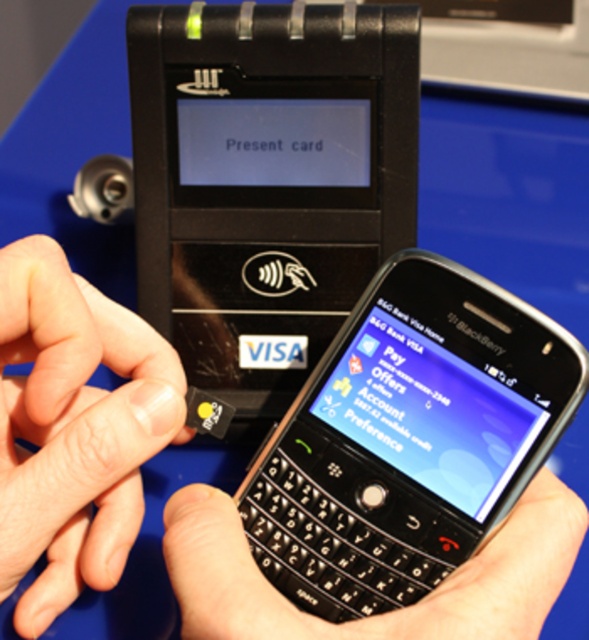
From the picture: Based on the scene description, where is the black plastic smartphone at center located in terms of coordinates?

The black plastic smartphone at center is located at point [408,438].